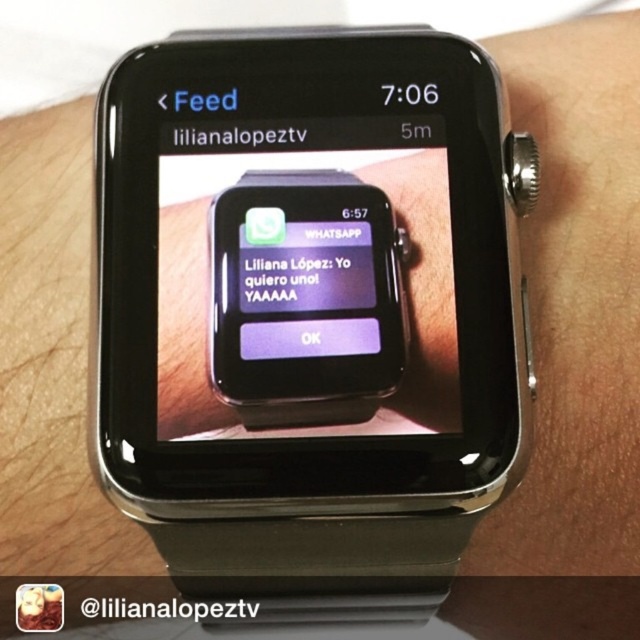
Question: Which is nearer to the black matte text at upper center?

Choices:
 (A) matte purple text at center
 (B) black metallic smartwatch at center

Answer: (A)

Question: Is the position of black matte watch face at center more distant than that of matte purple text at center?

Choices:
 (A) yes
 (B) no

Answer: (B)

Question: Can you confirm if black metallic smartwatch at center is thinner than black matte watch face at center?

Choices:
 (A) no
 (B) yes

Answer: (A)

Question: Which is farther from the matte purple text at center?

Choices:
 (A) black metallic smartwatch at center
 (B) black matte text at upper center

Answer: (B)

Question: Which point appears closest to the camera in this image?

Choices:
 (A) (385, 410)
 (B) (296, 125)
 (C) (483, 292)
 (D) (275, 260)

Answer: (A)

Question: Is black metallic smartwatch at center below black matte watch face at center?

Choices:
 (A) yes
 (B) no

Answer: (A)